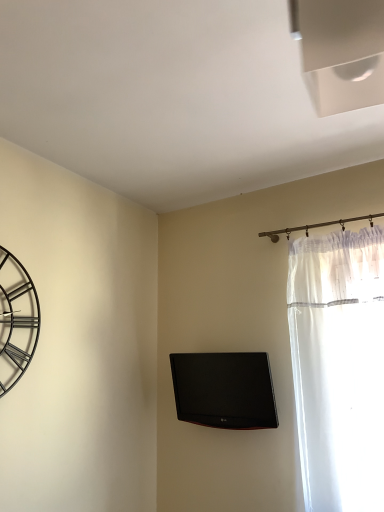
Question: Is metallic black clock at left positioned far away from black glossy tv at center?

Choices:
 (A) no
 (B) yes

Answer: (A)

Question: Considering the relative sizes of metallic black clock at left and black glossy tv at center in the image provided, is metallic black clock at left shorter than black glossy tv at center?

Choices:
 (A) yes
 (B) no

Answer: (B)

Question: Is the surface of metallic black clock at left in direct contact with black glossy tv at center?

Choices:
 (A) no
 (B) yes

Answer: (A)

Question: Is metallic black clock at left bigger than black glossy tv at center?

Choices:
 (A) no
 (B) yes

Answer: (A)

Question: Is metallic black clock at left aimed at black glossy tv at center?

Choices:
 (A) no
 (B) yes

Answer: (A)

Question: From the image's perspective, would you say metallic black clock at left is shown under black glossy tv at center?

Choices:
 (A) yes
 (B) no

Answer: (B)

Question: Is black glossy tv at center bigger than metallic black clock at left?

Choices:
 (A) no
 (B) yes

Answer: (B)

Question: From a real-world perspective, does black glossy tv at center sit lower than metallic black clock at left?

Choices:
 (A) yes
 (B) no

Answer: (A)

Question: Could you tell me if black glossy tv at center is turned towards metallic black clock at left?

Choices:
 (A) yes
 (B) no

Answer: (A)

Question: Is the position of black glossy tv at center more distant than that of metallic black clock at left?

Choices:
 (A) no
 (B) yes

Answer: (B)

Question: Is black glossy tv at center wider than metallic black clock at left?

Choices:
 (A) yes
 (B) no

Answer: (A)

Question: Is black glossy tv at center taller than metallic black clock at left?

Choices:
 (A) yes
 (B) no

Answer: (B)

Question: Is point (240, 361) closer or farther from the camera than point (33, 290)?

Choices:
 (A) closer
 (B) farther

Answer: (B)